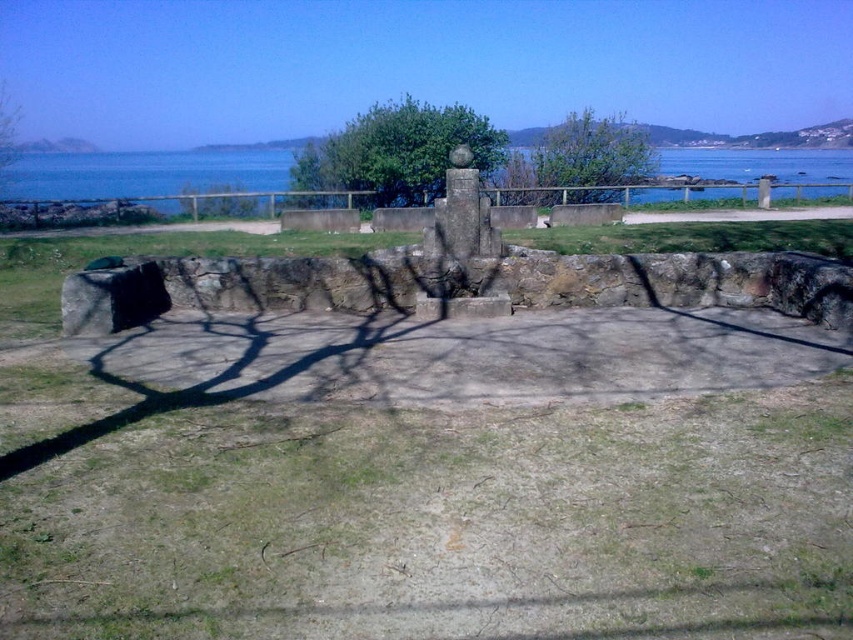
Question: Estimate the real-world distances between objects in this image. Which object is closer to the green leafy tree at upper center?

Choices:
 (A) green leafy tree at center
 (B) blue water at upper center

Answer: (A)

Question: Does blue water at upper center appear on the right side of green leafy tree at upper center?

Choices:
 (A) yes
 (B) no

Answer: (B)

Question: Is blue water at upper center further to the viewer compared to green leafy tree at center?

Choices:
 (A) yes
 (B) no

Answer: (B)

Question: Among these objects, which one is farthest from the camera?

Choices:
 (A) blue water at upper center
 (B) green leafy tree at upper center
 (C) green leafy tree at center

Answer: (C)

Question: Is blue water at upper center bigger than green leafy tree at upper center?

Choices:
 (A) no
 (B) yes

Answer: (B)

Question: Which of the following is the closest to the observer?

Choices:
 (A) (35, 192)
 (B) (585, 172)

Answer: (B)